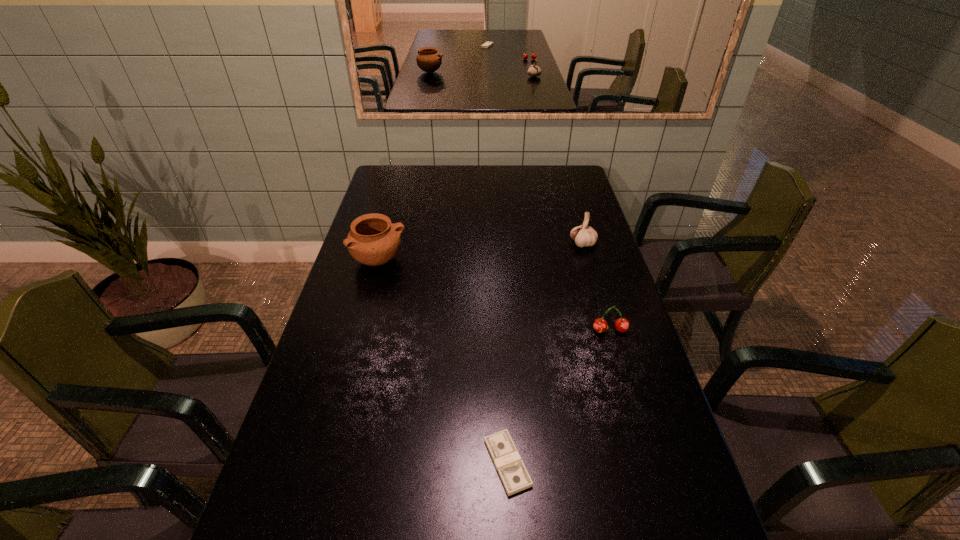
Where is `the tallest object`? Image resolution: width=960 pixels, height=540 pixels. the tallest object is located at coordinates (373, 240).

Locate an element on the screen. The image size is (960, 540). pottery is located at coordinates (373, 240).

Locate an element on the screen. The height and width of the screenshot is (540, 960). garlic is located at coordinates (584, 235).

The image size is (960, 540). What are the coordinates of `the third farthest object` in the screenshot? It's located at (600, 325).

Locate an element on the screen. cherry is located at coordinates (600, 325).

Locate an element on the screen. The image size is (960, 540). the second object from left to right is located at coordinates pos(510,467).

Locate an element on the screen. This screenshot has height=540, width=960. the shortest object is located at coordinates [x=510, y=467].

The image size is (960, 540). In order to click on free point located 0.090m on the front of the tallest object in this screenshot , I will do `click(370, 296)`.

The height and width of the screenshot is (540, 960). Identify the location of vacant point located 0.220m on the front of the second tallest object. (x=598, y=296).

Locate an element on the screen. vacant region located 0.060m with stems pointing upwards on the second nearest object is located at coordinates (616, 353).